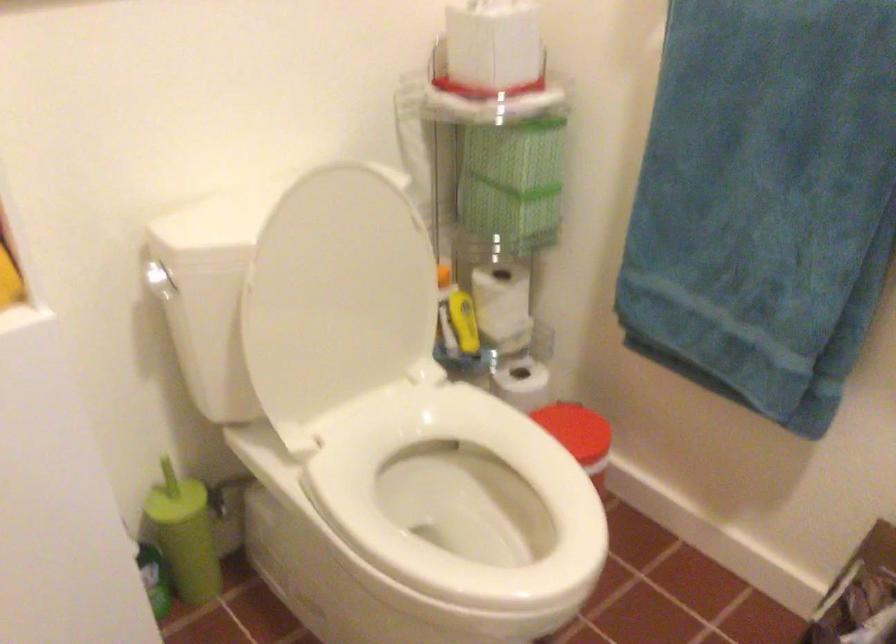
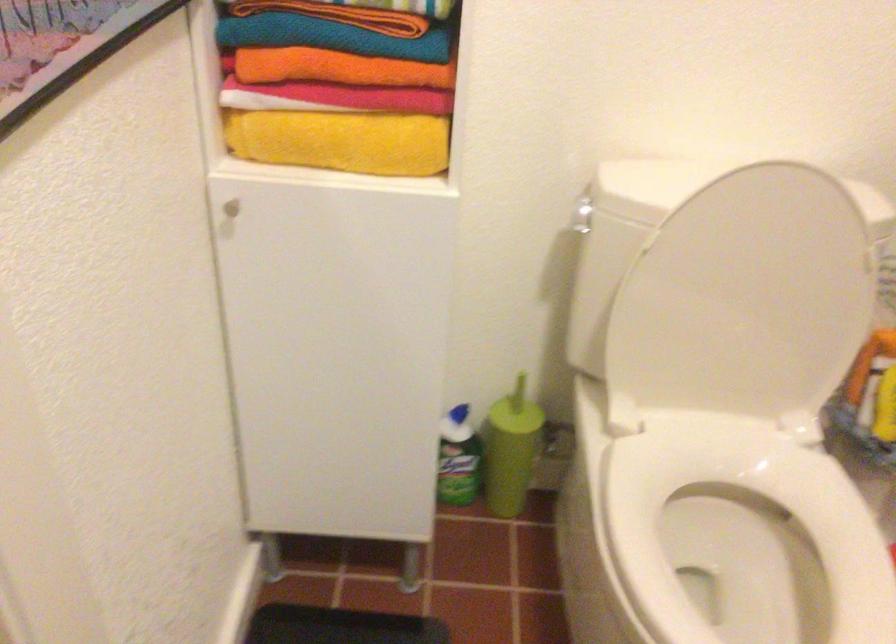
Question: The camera is either moving clockwise (left) or counter-clockwise (right) around the object. The first image is from the beginning of the video and the second image is from the end. Is the camera moving left or right when shooting the video?

Choices:
 (A) Left
 (B) Right

Answer: (B)